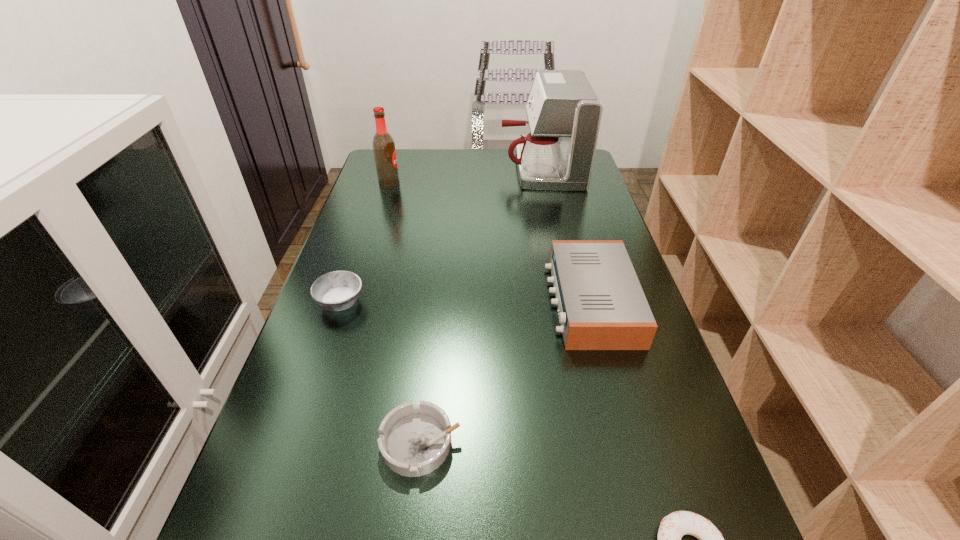
The height and width of the screenshot is (540, 960). What are the coordinates of `vacant space located 0.050m on the front of the beer bottle` in the screenshot? It's located at (385, 197).

The image size is (960, 540). Identify the location of free space located on the control panel of the radio receiver. (413, 302).

Find the location of a particular element. The width and height of the screenshot is (960, 540). vacant area situated on the control panel of the radio receiver is located at coordinates (528, 302).

Where is `vacant area situated on the control panel of the radio receiver`? This screenshot has height=540, width=960. vacant area situated on the control panel of the radio receiver is located at coordinates (520, 302).

This screenshot has height=540, width=960. Find the location of `free space located on the front of the taller ashtray`. free space located on the front of the taller ashtray is located at coordinates (277, 489).

Locate an element on the screen. free spot located 0.390m on the back of the right ashtray is located at coordinates tap(439, 273).

Find the location of a particular element. The height and width of the screenshot is (540, 960). coffee maker at the far edge is located at coordinates (564, 114).

Where is `beer bottle located at the far edge`? This screenshot has width=960, height=540. beer bottle located at the far edge is located at coordinates (383, 144).

Image resolution: width=960 pixels, height=540 pixels. I want to click on beer bottle located in the left edge section of the desktop, so click(383, 144).

Where is `ashtray that is at the left edge`? The height and width of the screenshot is (540, 960). ashtray that is at the left edge is located at coordinates coord(338,290).